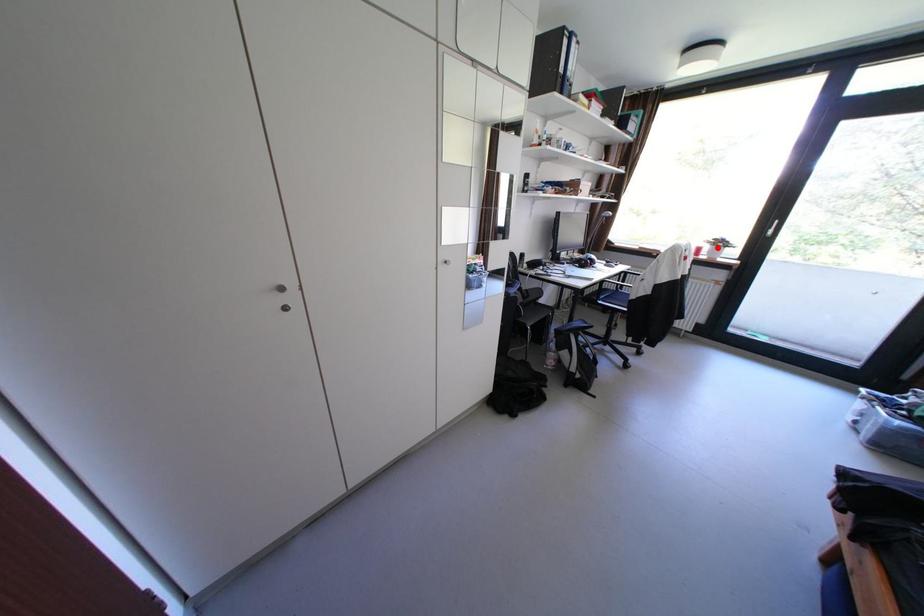
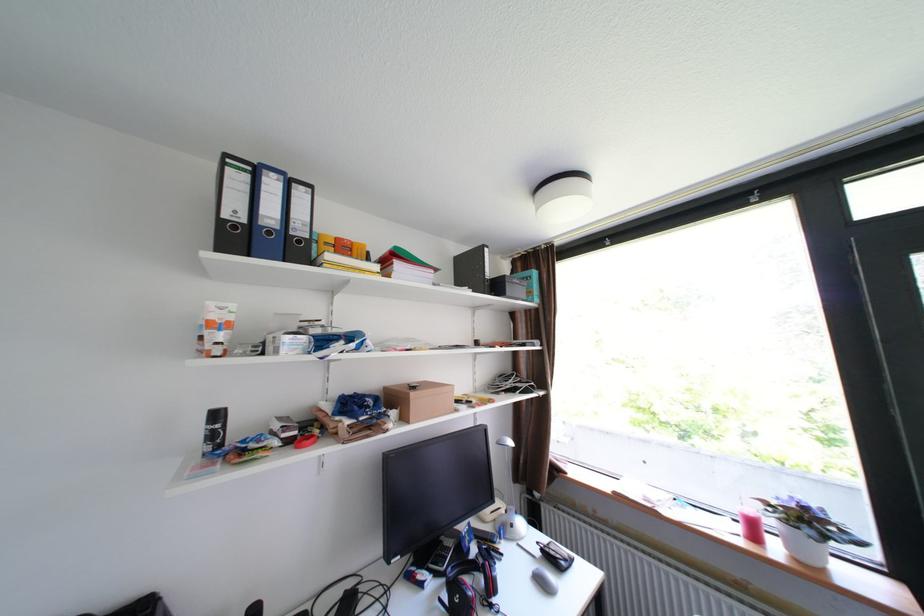
Locate, in the second image, the point that corresponds to the highlighted location in the first image.

(782, 523)